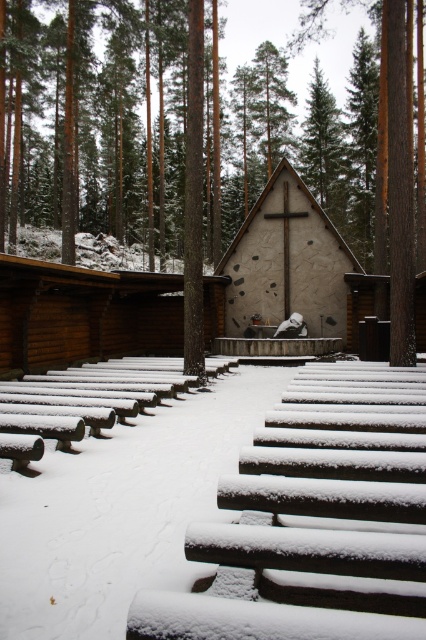
Question: Which point is closer to the camera taking this photo?

Choices:
 (A) (78, 416)
 (B) (287, 257)

Answer: (A)

Question: Is snow-covered wood at center to the right of wooden bench at center from the viewer's perspective?

Choices:
 (A) yes
 (B) no

Answer: (A)

Question: Is brown wooden cabin at center to the right of stucco cross at center from the viewer's perspective?

Choices:
 (A) yes
 (B) no

Answer: (B)

Question: Does snow-covered wood at center appear on the left side of stucco cross at center?

Choices:
 (A) no
 (B) yes

Answer: (B)

Question: Which of the following is the farthest from the observer?

Choices:
 (A) (322, 282)
 (B) (278, 477)

Answer: (A)

Question: Which object is farther from the camera taking this photo?

Choices:
 (A) stucco cross at center
 (B) wooden bench at center
 (C) snow-covered wood at center

Answer: (A)